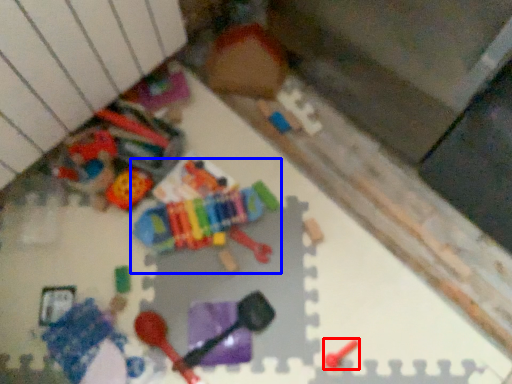
Question: Which object is closer to the camera taking this photo, toy (highlighted by a red box) or toy (highlighted by a blue box)?

Choices:
 (A) toy
 (B) toy

Answer: (A)